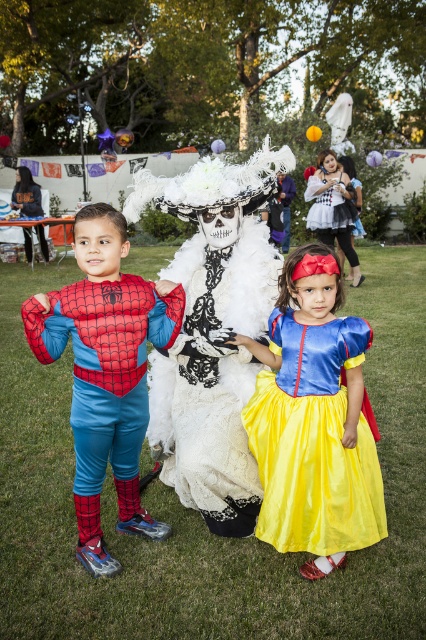
Question: Is white lace dress at center positioned before matte red spider-man costume at left?

Choices:
 (A) no
 (B) yes

Answer: (A)

Question: Among these objects, which one is nearest to the camera?

Choices:
 (A) matte white dress at center
 (B) silky yellow dress at center
 (C) white lace dress at center

Answer: (B)

Question: Can you confirm if white lace dress at center is positioned to the left of silky yellow dress at center?

Choices:
 (A) no
 (B) yes

Answer: (B)

Question: Can you confirm if white lace dress at center is bigger than silky yellow dress at center?

Choices:
 (A) no
 (B) yes

Answer: (B)

Question: Which of the following is the farthest from the observer?

Choices:
 (A) (268, 403)
 (B) (103, 404)

Answer: (A)

Question: Based on their relative distances, which object is nearer to the matte white dress at center?

Choices:
 (A) matte red spider-man costume at left
 (B) silky yellow dress at center

Answer: (B)